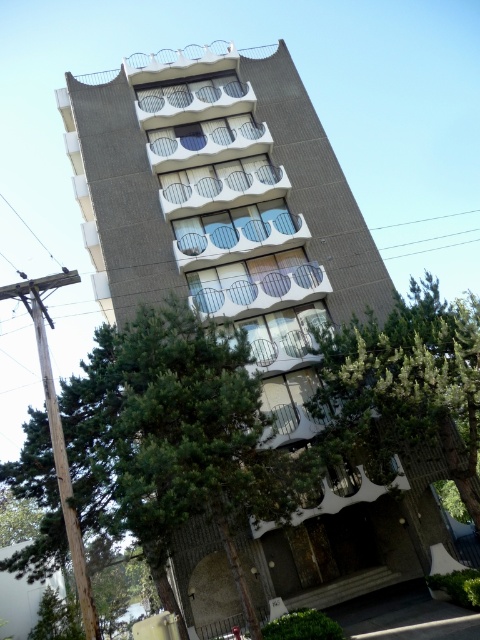
Measure the distance from green leafy tree at center to green leafy tree at lower right.

They are 5.97 meters apart.

Consider the image. Who is taller, green leafy tree at center or green leafy tree at lower right?

green leafy tree at lower right is taller.

Who is more forward, (130, 442) or (352, 420)?

Positioned in front is point (130, 442).

Find the location of `green leafy tree at center`. green leafy tree at center is located at coordinates (175, 438).